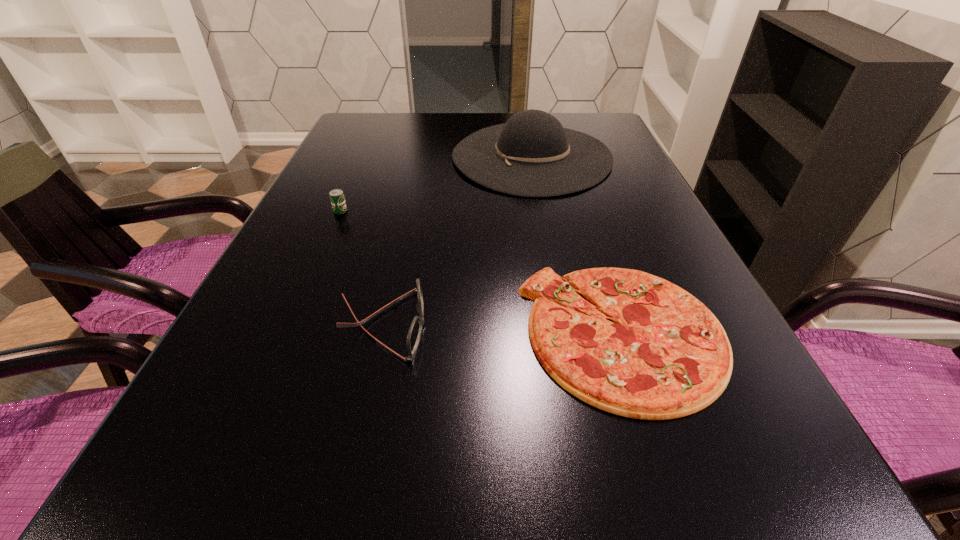
At what (x,y) coordinates should I click in order to perform the action: click on free area in between the sombrero and the spectacles. Please return your answer as a coordinate pair (x, y). The height and width of the screenshot is (540, 960). Looking at the image, I should click on (457, 241).

Find the location of a particular element. empty space between the tallest object and the spectacles is located at coordinates point(457,241).

At what (x,y) coordinates should I click in order to perform the action: click on free spot between the leftmost object and the tallest object. Please return your answer as a coordinate pair (x, y). This screenshot has width=960, height=540. Looking at the image, I should click on (436, 184).

You are a GUI agent. You are given a task and a screenshot of the screen. Output one action in this format:
    pyautogui.click(x=<x>, y=<y>)
    Task: Click on the free space between the second object from left to right and the pizza
    The width and height of the screenshot is (960, 540).
    Given the screenshot: What is the action you would take?
    pyautogui.click(x=503, y=329)

I want to click on empty space between the shortest object and the leftmost object, so click(x=481, y=272).

The width and height of the screenshot is (960, 540). In order to click on unoccupied position between the leftmost object and the shortest object in this screenshot , I will do `click(481, 272)`.

Find the location of a particular element. Image resolution: width=960 pixels, height=540 pixels. empty space that is in between the leftmost object and the sombrero is located at coordinates (436, 184).

You are a GUI agent. You are given a task and a screenshot of the screen. Output one action in this format:
    pyautogui.click(x=<x>, y=<y>)
    Task: Click on the empty location between the spectacles and the tallest object
    This screenshot has height=540, width=960.
    Given the screenshot: What is the action you would take?
    pyautogui.click(x=457, y=241)

Choose which object is the third nearest neighbor to the spectacles. Please provide its 2D coordinates. Your answer should be formatted as a tuple, i.e. [(x, y)], where the tuple contains the x and y coordinates of a point satisfying the conditions above.

[(531, 155)]

Select which object appears as the third closest to the tallest object. Please provide its 2D coordinates. Your answer should be formatted as a tuple, i.e. [(x, y)], where the tuple contains the x and y coordinates of a point satisfying the conditions above.

[(414, 334)]